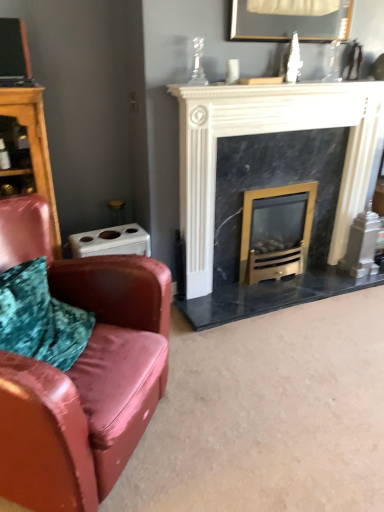
Locate an element on the screen. This screenshot has width=384, height=512. free point in front of black marble fireplace at center is located at coordinates (267, 295).